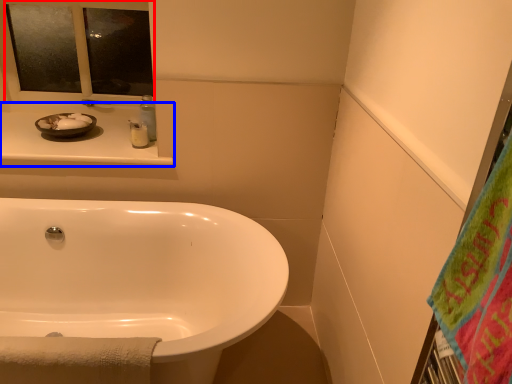
Question: Which of the following is the closest to the observer, mirror (highlighted by a red box) or counter top (highlighted by a blue box)?

Choices:
 (A) mirror
 (B) counter top

Answer: (B)